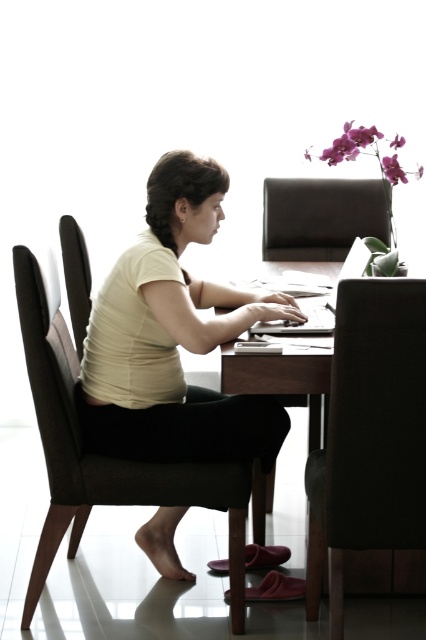
Does matte yellow shirt at center have a smaller size compared to brown leather chair at center?

No, matte yellow shirt at center is not smaller than brown leather chair at center.

Is matte yellow shirt at center above brown leather chair at center?

Indeed, matte yellow shirt at center is positioned over brown leather chair at center.

Is point (169, 268) closer to camera compared to point (311, 545)?

Yes, point (169, 268) is closer to viewer.

The height and width of the screenshot is (640, 426). Identify the location of matte yellow shirt at center. (173, 337).

Is matte yellow shirt at center wider than silver metallic laptop at center?

Indeed, matte yellow shirt at center has a greater width compared to silver metallic laptop at center.

Consider the image. Can you confirm if matte yellow shirt at center is positioned to the left of silver metallic laptop at center?

Correct, you'll find matte yellow shirt at center to the left of silver metallic laptop at center.

The image size is (426, 640). I want to click on matte yellow shirt at center, so click(x=173, y=337).

Can you confirm if brown fabric chair at center is positioned above dark brown leather chair at left?

Actually, brown fabric chair at center is below dark brown leather chair at left.

Does point (49, 429) come in front of point (80, 300)?

Yes.

Is point (37, 356) positioned in front of point (66, 284)?

Yes, it is in front of point (66, 284).

Locate an element on the screen. brown fabric chair at center is located at coordinates (100, 456).